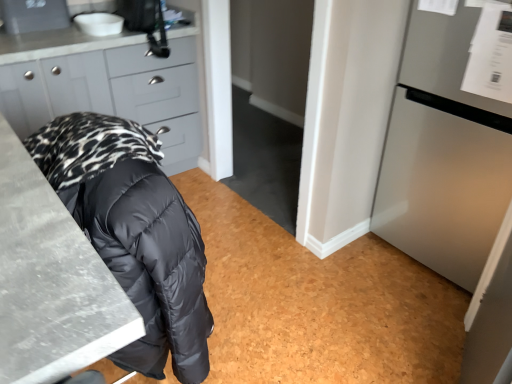
You are a GUI agent. You are given a task and a screenshot of the screen. Output one action in this format:
    pyautogui.click(x=<x>, y=<y>)
    Task: Click on the unoccupied area in front of satin silver refrigerator at right
    
    Given the screenshot: What is the action you would take?
    pyautogui.click(x=415, y=319)